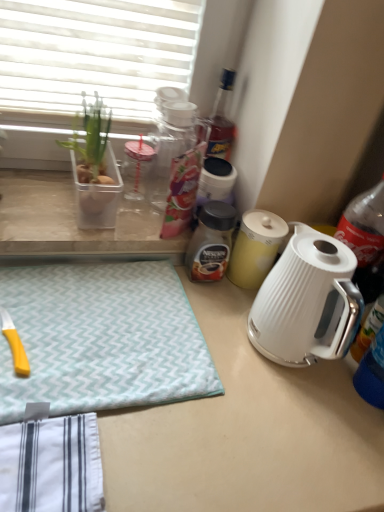
This screenshot has height=512, width=384. I want to click on vacant area that is situated to the right of clear plastic container at upper left, so click(x=132, y=219).